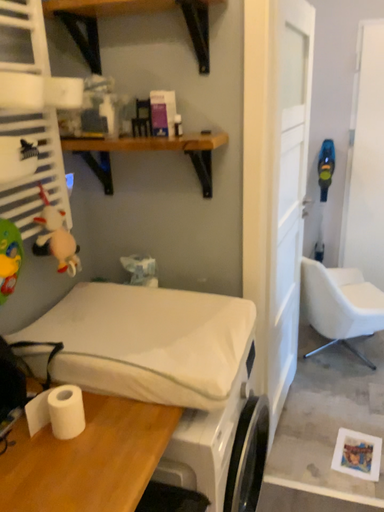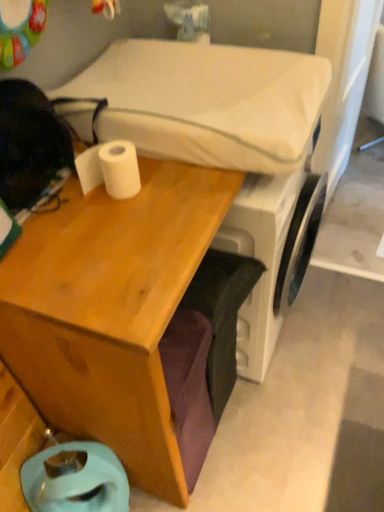
Question: Which way did the camera rotate in the video?

Choices:
 (A) rotated upward
 (B) rotated downward

Answer: (B)